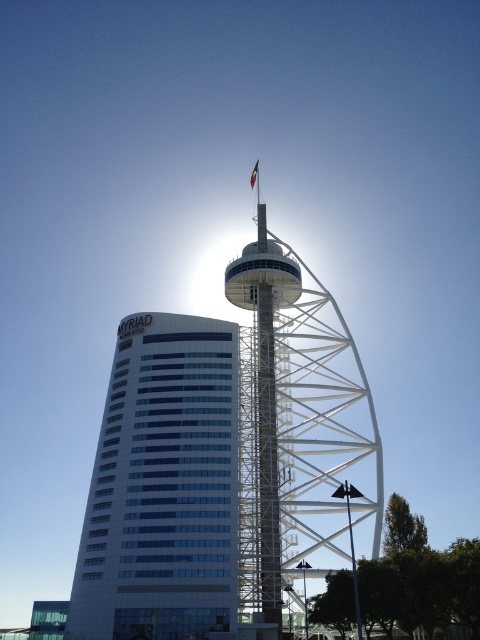
Is white glass building at left to the left of white metallic tower at center from the viewer's perspective?

Correct, you'll find white glass building at left to the left of white metallic tower at center.

Which is behind, point (205, 570) or point (251, 602)?

The point (251, 602) is behind.

Is point (228, 636) farther from viewer compared to point (373, 420)?

No, (228, 636) is in front of (373, 420).

Find the location of `white glass building at left`. white glass building at left is located at coordinates (163, 486).